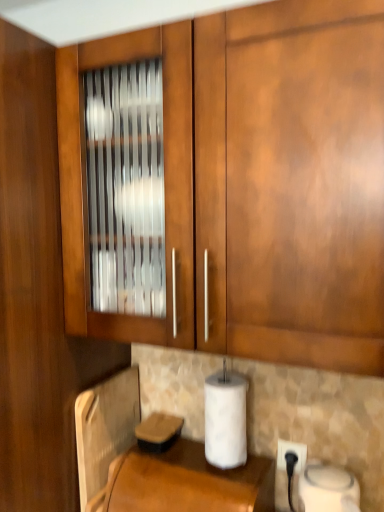
The height and width of the screenshot is (512, 384). I want to click on free region on the left part of white matte paper towel at lower center, so click(x=176, y=462).